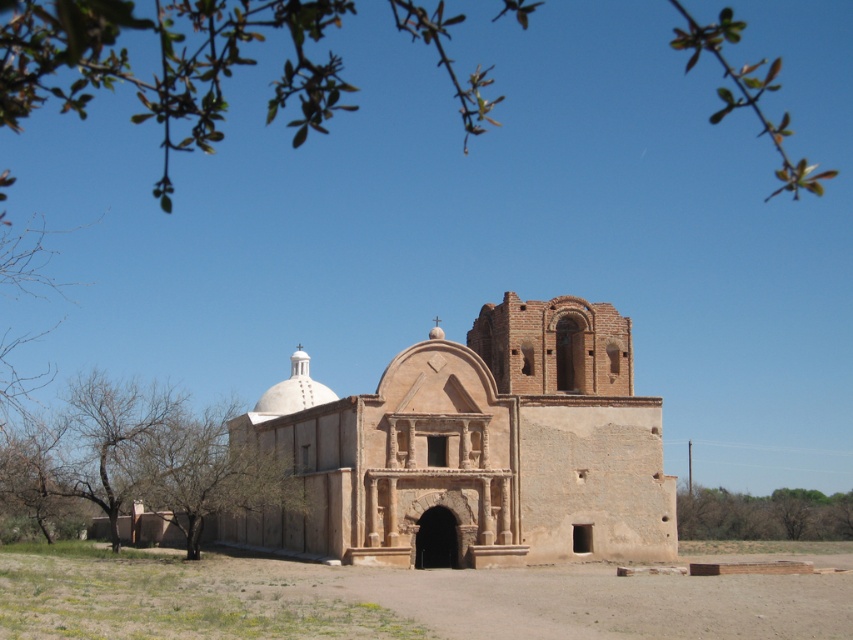
Question: Does green leafy branches at upper center appear over green leafy tree at lower left?

Choices:
 (A) no
 (B) yes

Answer: (B)

Question: Among these objects, which one is farthest from the camera?

Choices:
 (A) green leafy tree at lower left
 (B) brown stone church at center

Answer: (A)

Question: Which object is the closest to the green leafy branches at upper center?

Choices:
 (A) green leafy tree at lower right
 (B) brown stone church at center

Answer: (B)

Question: Estimate the real-world distances between objects in this image. Which object is closer to the brown stone church at center?

Choices:
 (A) green leafy tree at lower left
 (B) green leafy tree at lower right
 (C) green leafy branches at upper center

Answer: (A)

Question: Is green leafy branches at upper center to the right of green leafy tree at lower right from the viewer's perspective?

Choices:
 (A) yes
 (B) no

Answer: (B)

Question: Is brown stone church at center bigger than green leafy tree at lower left?

Choices:
 (A) yes
 (B) no

Answer: (A)